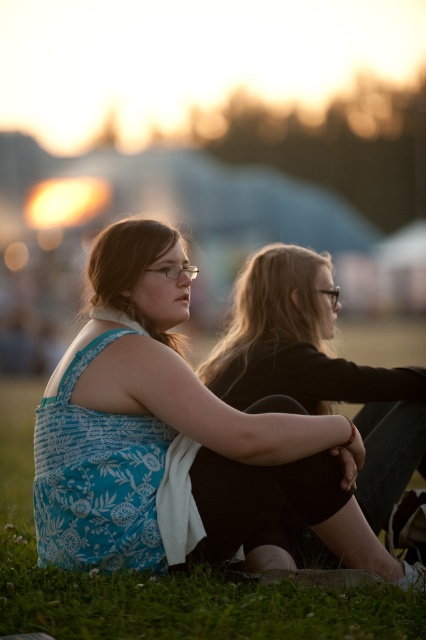
Does green grass at lower center appear on the left side of matte black hair at center?

Indeed, green grass at lower center is positioned on the left side of matte black hair at center.

Locate an element on the screen. Image resolution: width=426 pixels, height=640 pixels. green grass at lower center is located at coordinates pos(161,579).

The width and height of the screenshot is (426, 640). Identify the location of green grass at lower center. pyautogui.click(x=161, y=579).